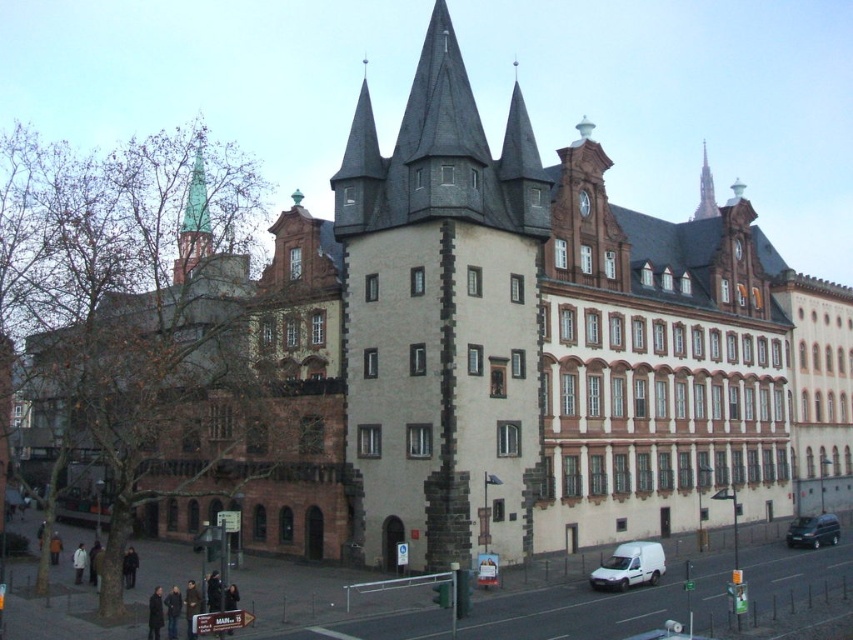
You are a drone operator who needs to fly a drone between the green glass tower at upper left and the glass spire at upper right. Based on the building structure, which object is wider to ensure safe passage?

The green glass tower at upper left might be wider than the glass spire at upper right, so the drone should pass near the green glass tower at upper left for safer passage.

You are a delivery person who needs to park your white matte van at lower right and dark green matte van at lower right in a parking spot that is 5 meters long. Which van can fit in the parking spot?

The white matte van at lower right is shorter than the dark green matte van at lower right. Since the parking spot is 5 meters long, the white matte van at lower right can fit, but the dark green matte van at lower right might be too long.

You are a delivery driver trying to park your white matte van at lower right near the building. The parking spot has a width restriction marked by the metallic clock at upper center. Can your van fit within the space indicated by the clock?

The white matte van at lower right might be wider than the metallic clock at upper center, so there is a possibility that the van may not fit within the width restriction marked by the clock. It is advisable to check the exact dimensions before attempting to park.